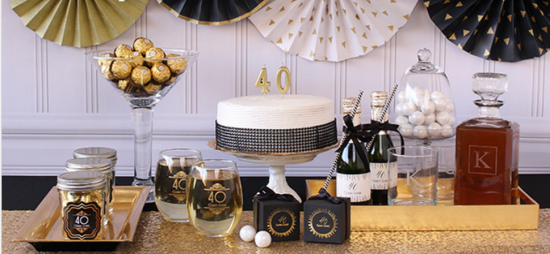
Where is `gold cover on table`? The width and height of the screenshot is (550, 254). gold cover on table is located at coordinates (412, 243).